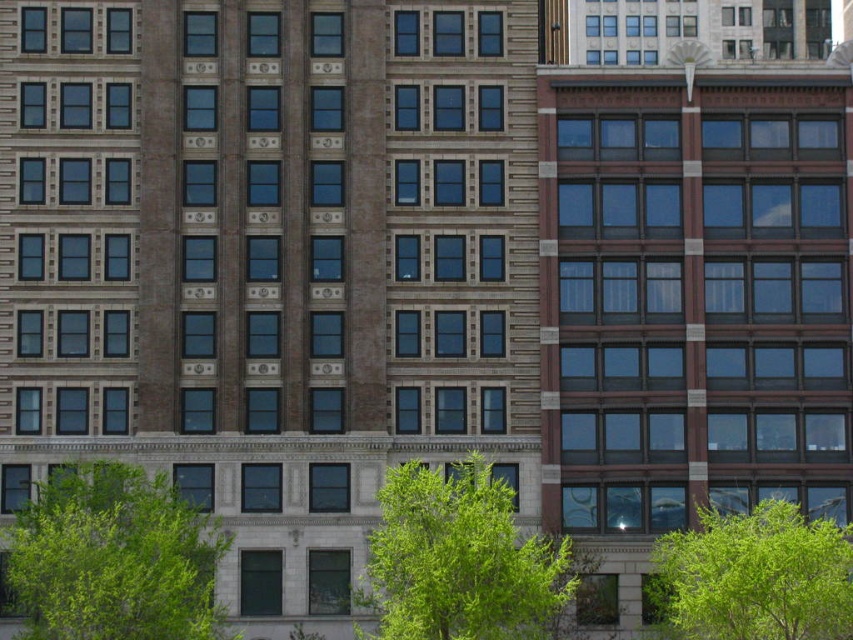
Who is more forward, (154, 522) or (503, 516)?

Point (503, 516) is in front.

This screenshot has height=640, width=853. I want to click on green leafy tree at lower left, so click(x=113, y=557).

Can you confirm if green leafy tree at lower left is thinner than green leafy tree at lower right?

In fact, green leafy tree at lower left might be wider than green leafy tree at lower right.

Is point (33, 595) positioned in front of point (717, 522)?

That is True.

Locate an element on the screen. The image size is (853, 640). green leafy tree at lower left is located at coordinates (113, 557).

Does green leafy tree at lower center have a smaller size compared to green leafy tree at lower right?

Actually, green leafy tree at lower center might be larger than green leafy tree at lower right.

Can you confirm if green leafy tree at lower center is shorter than green leafy tree at lower right?

No, green leafy tree at lower center is not shorter than green leafy tree at lower right.

Find the location of `green leafy tree at lower center`. green leafy tree at lower center is located at coordinates (460, 560).